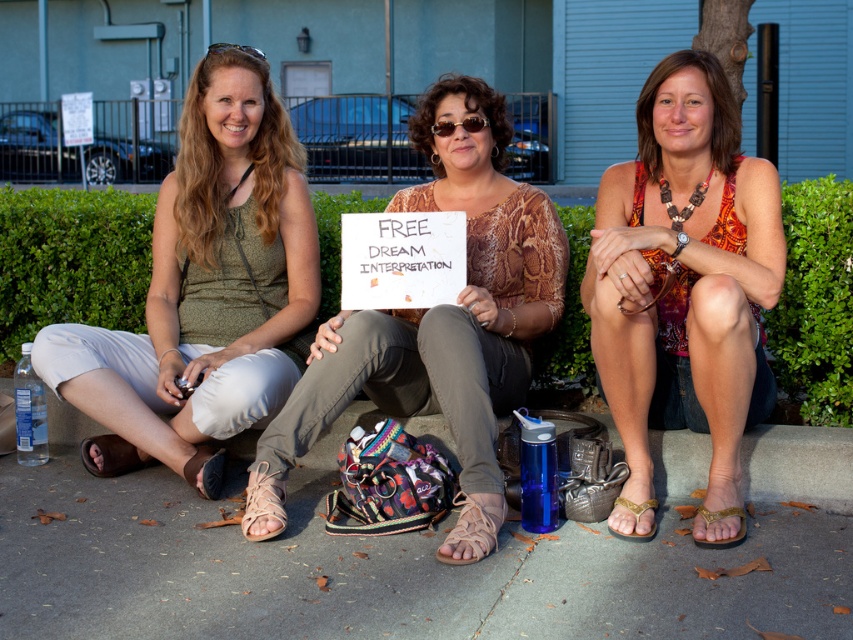
Question: Which of the following is the farthest from the observer?

Choices:
 (A) green leafy hedge at lower right
 (B) patterned fabric tank top at center
 (C) tan leather sandal at lower left
 (D) brown leather sandal at center

Answer: (C)

Question: Is brown leather sandal at lower left smaller than gold metallic sandal at lower right?

Choices:
 (A) yes
 (B) no

Answer: (B)

Question: Which point is closer to the camera?

Choices:
 (A) (587, 586)
 (B) (664, 317)
 (C) (125, 465)

Answer: (A)

Question: Does brown leather sandal at lower left appear over tan leather sandal at lower left?

Choices:
 (A) no
 (B) yes

Answer: (B)

Question: In this image, where is patterned fabric tank top at center located relative to tan leather sandal at lower center?

Choices:
 (A) left
 (B) right

Answer: (B)

Question: Among these objects, which one is nearest to the camera?

Choices:
 (A) brown leather sandal at center
 (B) patterned fabric tank top at center
 (C) clear plastic goggles at center

Answer: (B)